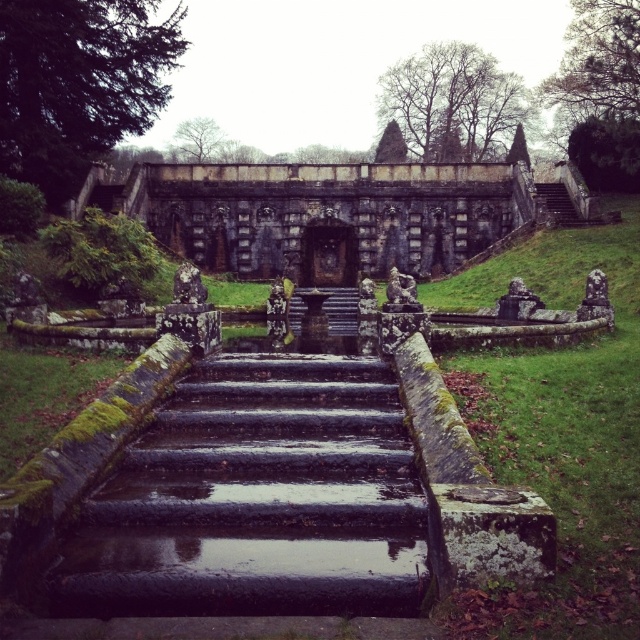
You are standing at the base of the mossy stone stairs at center. If you walk straight ahead, will you reach the central fountain or the pool below?

The mossy stone stairs at center lead up to the central fountain, so walking straight ahead would take you toward the central fountain first before reaching the pool below.

You are standing at the base of the ancient stone structure and want to take a photo of both the slate gray stone lion at center and the green stone statue at center. Which direction should you face to ensure both are visible in your camera frame?

You should face to the left so that both the slate gray stone lion at center and the green stone statue at center are visible in your frame, as the slate gray stone lion at center is positioned to the right of the green stone statue at center.